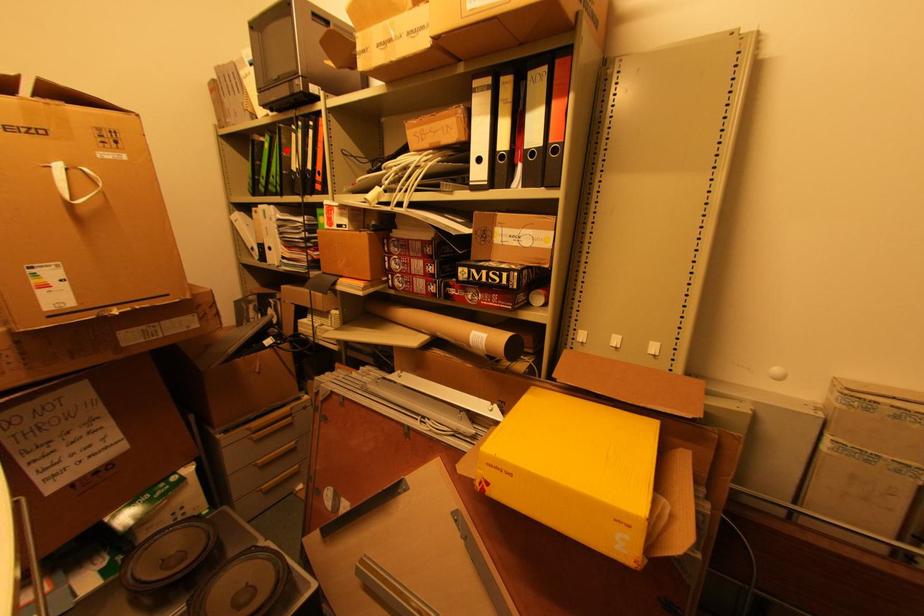
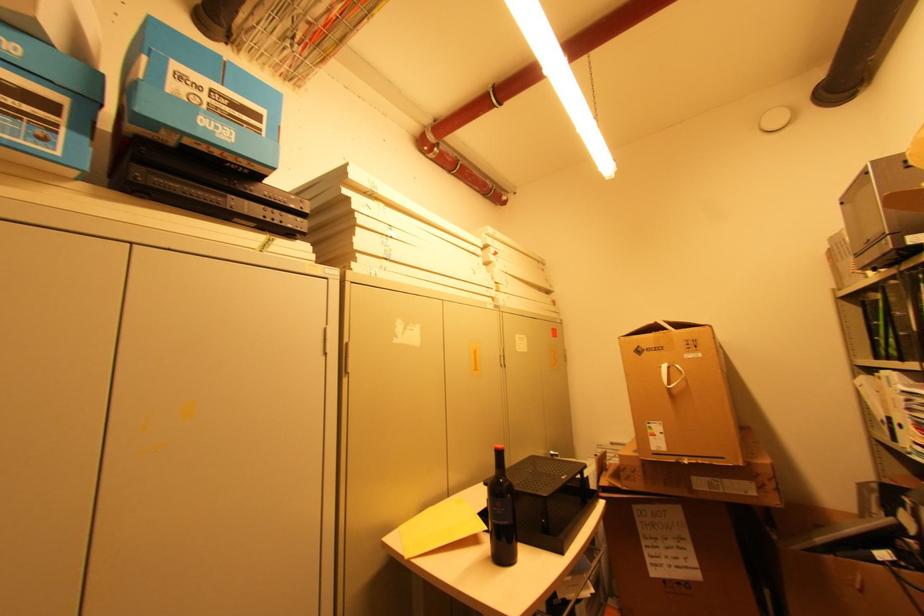
The point at the highlighted location is marked in the first image. Where is the corresponding point in the second image?

(896, 310)